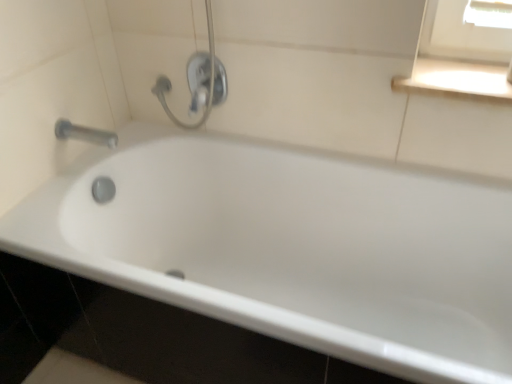
At what (x,y) coordinates should I click in order to perform the action: click on white glossy window sill at upper right. Please return your answer as a coordinate pair (x, y). Image resolution: width=512 pixels, height=384 pixels. Looking at the image, I should click on (458, 79).

Describe the element at coordinates (85, 134) in the screenshot. The image size is (512, 384). I see `silver metallic tap at upper left` at that location.

Measure the distance between white glossy bathtub at center and camera.

white glossy bathtub at center is 30.16 inches from camera.

Consider the image. What is the approximate width of white glossy bathtub at center?

69.38 centimeters.

Locate an element on the screen. The image size is (512, 384). white glossy window sill at upper right is located at coordinates (458, 79).

How much distance is there between satin nickel faucet at upper center and white glossy window sill at upper right?

25.39 inches.

Which is correct: satin nickel faucet at upper center is inside white glossy window sill at upper right, or outside of it?

The correct answer is: outside.

The height and width of the screenshot is (384, 512). Find the location of `shower directly beneath the white glossy window sill at upper right (from a real-world perspective)`. shower directly beneath the white glossy window sill at upper right (from a real-world perspective) is located at coordinates (199, 80).

Is satin nickel faucet at upper center positioned with its back to white glossy window sill at upper right?

No, satin nickel faucet at upper center is not facing the opposite direction of white glossy window sill at upper right.

From the image's perspective, is silver metallic tap at upper left located above or below white glossy window sill at upper right?

silver metallic tap at upper left is below white glossy window sill at upper right.

Measure the distance between silver metallic tap at upper left and white glossy window sill at upper right.

silver metallic tap at upper left is 3.48 feet away from white glossy window sill at upper right.

Between silver metallic tap at upper left and white glossy window sill at upper right, which one appears on the left side from the viewer's perspective?

silver metallic tap at upper left.

From a real-world perspective, is silver metallic tap at upper left beneath white glossy window sill at upper right?

Correct, in the physical world, silver metallic tap at upper left is lower than white glossy window sill at upper right.

From a real-world perspective, which object stands above the other?

In real-world perspective, silver metallic tap at upper left is above.

Considering the positions of objects white glossy bathtub at center and silver metallic tap at upper left in the image provided, who is in front, white glossy bathtub at center or silver metallic tap at upper left?

white glossy bathtub at center is in front.

Is there a large distance between white glossy bathtub at center and silver metallic tap at upper left?

white glossy bathtub at center is actually quite close to silver metallic tap at upper left.

At what (x,y) coordinates should I click in order to perform the action: click on bathtub to the right of silver metallic tap at upper left. Please return your answer as a coordinate pair (x, y). Image resolution: width=512 pixels, height=384 pixels. Looking at the image, I should click on (292, 248).

From the picture: Can you confirm if satin nickel faucet at upper center is wider than white glossy bathtub at center?

No.

Who is shorter, satin nickel faucet at upper center or white glossy bathtub at center?

satin nickel faucet at upper center is shorter.

Are satin nickel faucet at upper center and white glossy bathtub at center located far from each other?

No, satin nickel faucet at upper center is not far away from white glossy bathtub at center.

Could you tell me if white glossy bathtub at center is facing white glossy window sill at upper right?

No, white glossy bathtub at center is not aimed at white glossy window sill at upper right.

The image size is (512, 384). In order to click on bathtub in front of the white glossy window sill at upper right in this screenshot , I will do `click(292, 248)`.

How different are the orientations of white glossy bathtub at center and white glossy window sill at upper right in degrees?

They differ by 0.077 degrees in their facing directions.

Is white glossy bathtub at center at the left side of white glossy window sill at upper right?

Yes, white glossy bathtub at center is to the left of white glossy window sill at upper right.

Which object is further away from the camera taking this photo, silver metallic tap at upper left or satin nickel faucet at upper center?

satin nickel faucet at upper center is more distant.

Which point is more distant from viewer, (58, 125) or (220, 96)?

Positioned behind is point (220, 96).

Does silver metallic tap at upper left have a greater height compared to satin nickel faucet at upper center?

Incorrect, the height of silver metallic tap at upper left is not larger of that of satin nickel faucet at upper center.

Locate an element on the screen. The image size is (512, 384). shower located above the silver metallic tap at upper left (from a real-world perspective) is located at coordinates (199, 80).

Identify the location of tap behind the white glossy window sill at upper right. (85, 134).

From a real-world perspective, is white glossy window sill at upper right positioned above or below silver metallic tap at upper left?

In terms of real-world spatial position, white glossy window sill at upper right is above silver metallic tap at upper left.

Does white glossy window sill at upper right have a larger size compared to silver metallic tap at upper left?

Yes, white glossy window sill at upper right is bigger than silver metallic tap at upper left.

Can you confirm if white glossy window sill at upper right is shorter than silver metallic tap at upper left?

Correct, white glossy window sill at upper right is not as tall as silver metallic tap at upper left.

At what (x,y) coordinates should I click in order to perform the action: click on shower that appears on the left of white glossy window sill at upper right. Please return your answer as a coordinate pair (x, y). Looking at the image, I should click on (199, 80).

In order to click on window sill above the silver metallic tap at upper left (from a real-world perspective) in this screenshot , I will do `click(458, 79)`.

When comparing their distances from white glossy bathtub at center, does satin nickel faucet at upper center or white glossy window sill at upper right seem further?

Among the two, white glossy window sill at upper right is located further to white glossy bathtub at center.

Looking at the image, which one is located further to satin nickel faucet at upper center, silver metallic tap at upper left or white glossy window sill at upper right?

white glossy window sill at upper right.

Considering their positions, is silver metallic tap at upper left positioned further to white glossy window sill at upper right than white glossy bathtub at center?

silver metallic tap at upper left lies further to white glossy window sill at upper right than the other object.

From the image, which object appears to be farther from satin nickel faucet at upper center, white glossy bathtub at center or white glossy window sill at upper right?

The object further to satin nickel faucet at upper center is white glossy window sill at upper right.

Considering their positions, is white glossy bathtub at center positioned further to silver metallic tap at upper left than satin nickel faucet at upper center?

white glossy bathtub at center is further to silver metallic tap at upper left.

When comparing their distances from silver metallic tap at upper left, does white glossy window sill at upper right or satin nickel faucet at upper center seem closer?

satin nickel faucet at upper center.

In the scene shown: Considering their positions, is white glossy window sill at upper right positioned closer to satin nickel faucet at upper center than white glossy bathtub at center?

Among the two, white glossy bathtub at center is located nearer to satin nickel faucet at upper center.

Looking at the image, which one is located closer to white glossy window sill at upper right, white glossy bathtub at center or silver metallic tap at upper left?

white glossy bathtub at center is closer to white glossy window sill at upper right.

Where is `bathtub between satin nickel faucet at upper center and white glossy window sill at upper right in the horizontal direction`? The width and height of the screenshot is (512, 384). bathtub between satin nickel faucet at upper center and white glossy window sill at upper right in the horizontal direction is located at coordinates (292, 248).

You are a GUI agent. You are given a task and a screenshot of the screen. Output one action in this format:
    pyautogui.click(x=<x>, y=<y>)
    Task: Click on the tap between white glossy bathtub at center and satin nickel faucet at upper center in the front-back direction
    
    Given the screenshot: What is the action you would take?
    pyautogui.click(x=85, y=134)

The image size is (512, 384). What are the coordinates of `bathtub between silver metallic tap at upper left and white glossy window sill at upper right from left to right` in the screenshot? It's located at (292, 248).

Locate an element on the screen. The image size is (512, 384). shower between silver metallic tap at upper left and white glossy window sill at upper right in the horizontal direction is located at coordinates (199, 80).